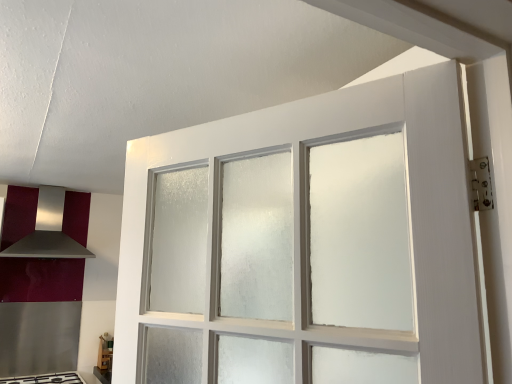
Question: Is white glossy gas stove at lower left positioned behind satin silver exhaust hood at left?

Choices:
 (A) yes
 (B) no

Answer: (B)

Question: Is white glossy gas stove at lower left facing towards satin silver exhaust hood at left?

Choices:
 (A) yes
 (B) no

Answer: (B)

Question: Does white glossy gas stove at lower left have a greater height compared to satin silver exhaust hood at left?

Choices:
 (A) no
 (B) yes

Answer: (A)

Question: Is white glossy gas stove at lower left looking in the opposite direction of satin silver exhaust hood at left?

Choices:
 (A) no
 (B) yes

Answer: (A)

Question: Does white glossy gas stove at lower left have a lesser height compared to satin silver exhaust hood at left?

Choices:
 (A) no
 (B) yes

Answer: (B)

Question: Is white glossy gas stove at lower left bigger than satin silver exhaust hood at left?

Choices:
 (A) yes
 (B) no

Answer: (B)

Question: Is the depth of satin silver exhaust hood at left less than that of white glossy gas stove at lower left?

Choices:
 (A) no
 (B) yes

Answer: (A)

Question: From the image's perspective, is satin silver exhaust hood at left located beneath white glossy gas stove at lower left?

Choices:
 (A) no
 (B) yes

Answer: (A)

Question: Is satin silver exhaust hood at left positioned behind white glossy gas stove at lower left?

Choices:
 (A) yes
 (B) no

Answer: (A)

Question: Does satin silver exhaust hood at left appear on the left side of white glossy gas stove at lower left?

Choices:
 (A) no
 (B) yes

Answer: (B)

Question: Can you confirm if satin silver exhaust hood at left is thinner than white glossy gas stove at lower left?

Choices:
 (A) yes
 (B) no

Answer: (A)

Question: Is satin silver exhaust hood at left wider than white glossy gas stove at lower left?

Choices:
 (A) yes
 (B) no

Answer: (B)

Question: Choose the correct answer: Is satin silver exhaust hood at left inside white glossy gas stove at lower left or outside it?

Choices:
 (A) outside
 (B) inside

Answer: (A)